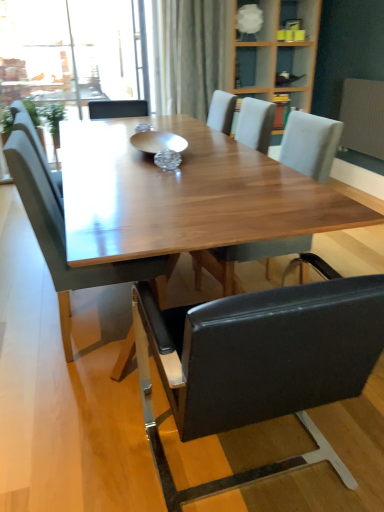
Question: Can you confirm if gold metallic bowl at center is shorter than white frosted glass lampshade at upper center?

Choices:
 (A) no
 (B) yes

Answer: (B)

Question: Considering the relative positions of gold metallic bowl at center and white frosted glass lampshade at upper center in the image provided, is gold metallic bowl at center behind white frosted glass lampshade at upper center?

Choices:
 (A) no
 (B) yes

Answer: (A)

Question: Is white frosted glass lampshade at upper center a part of gold metallic bowl at center?

Choices:
 (A) no
 (B) yes

Answer: (A)

Question: Is the depth of gold metallic bowl at center less than that of white frosted glass lampshade at upper center?

Choices:
 (A) yes
 (B) no

Answer: (A)

Question: Is gold metallic bowl at center taller than white frosted glass lampshade at upper center?

Choices:
 (A) yes
 (B) no

Answer: (B)

Question: From the image's perspective, is gold metallic bowl at center over white frosted glass lampshade at upper center?

Choices:
 (A) no
 (B) yes

Answer: (A)

Question: Is matte gray chair at left, which appears as the 3th chair when viewed from the right, at the right side of white frosted glass lampshade at upper center?

Choices:
 (A) no
 (B) yes

Answer: (A)

Question: Is matte gray chair at left, which appears as the 3th chair when viewed from the right, touching white frosted glass lampshade at upper center?

Choices:
 (A) yes
 (B) no

Answer: (B)

Question: Does matte gray chair at left, which is the 1th chair in left-to-right order, have a lesser height compared to white frosted glass lampshade at upper center?

Choices:
 (A) yes
 (B) no

Answer: (B)

Question: Does matte gray chair at left, which is the 1th chair in left-to-right order, have a greater height compared to white frosted glass lampshade at upper center?

Choices:
 (A) no
 (B) yes

Answer: (B)

Question: Would you say white frosted glass lampshade at upper center is part of matte gray chair at left, which is the 1th chair in left-to-right order,'s contents?

Choices:
 (A) yes
 (B) no

Answer: (B)

Question: Is matte gray chair at left, which is the 1th chair in left-to-right order, wider than white frosted glass lampshade at upper center?

Choices:
 (A) no
 (B) yes

Answer: (B)

Question: Considering the relative sizes of white textured radiator at right and light gray fabric chair at center, the third chair positioned from the left, in the image provided, is white textured radiator at right thinner than light gray fabric chair at center, the third chair positioned from the left,?

Choices:
 (A) no
 (B) yes

Answer: (B)